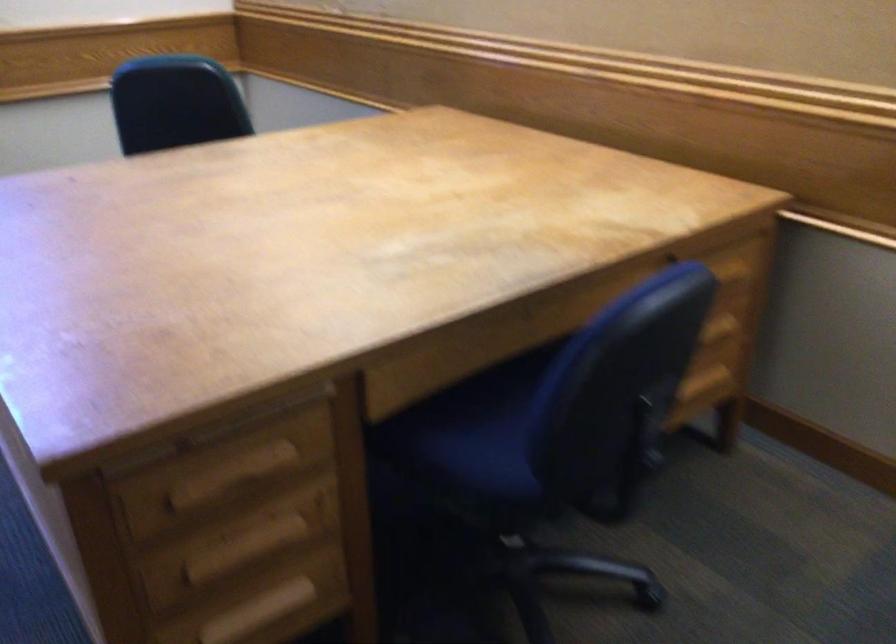
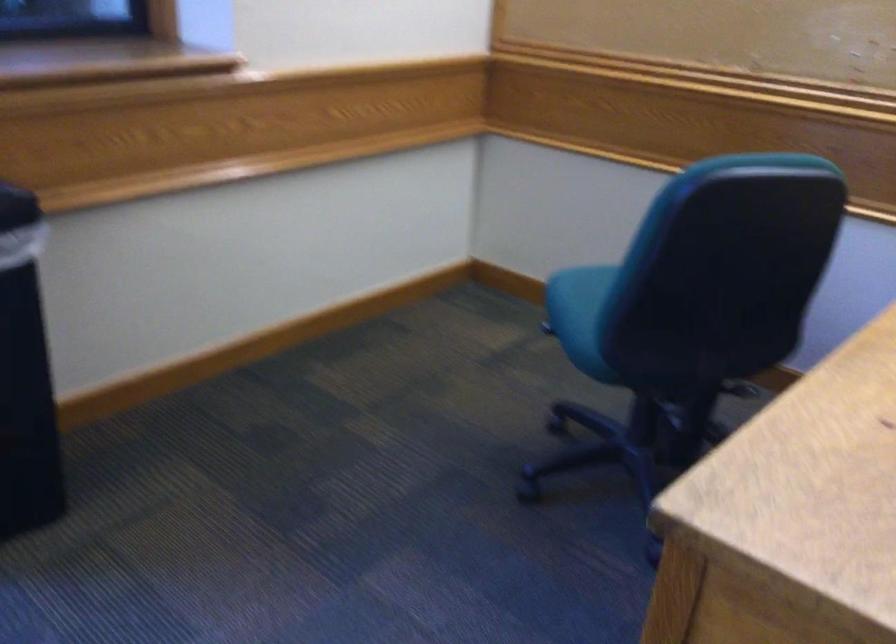
The images are taken continuously from a first-person perspective. In which direction are you moving?

The cameraman walked toward left, forward.